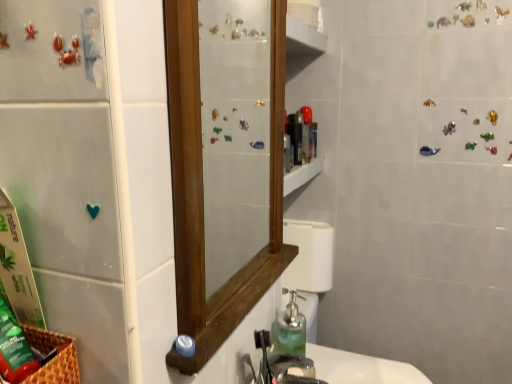
Identify the location of blank space situated above white glossy sink at lower center, the 2th sink positioned from the back (from a real-world perspective). (360, 367).